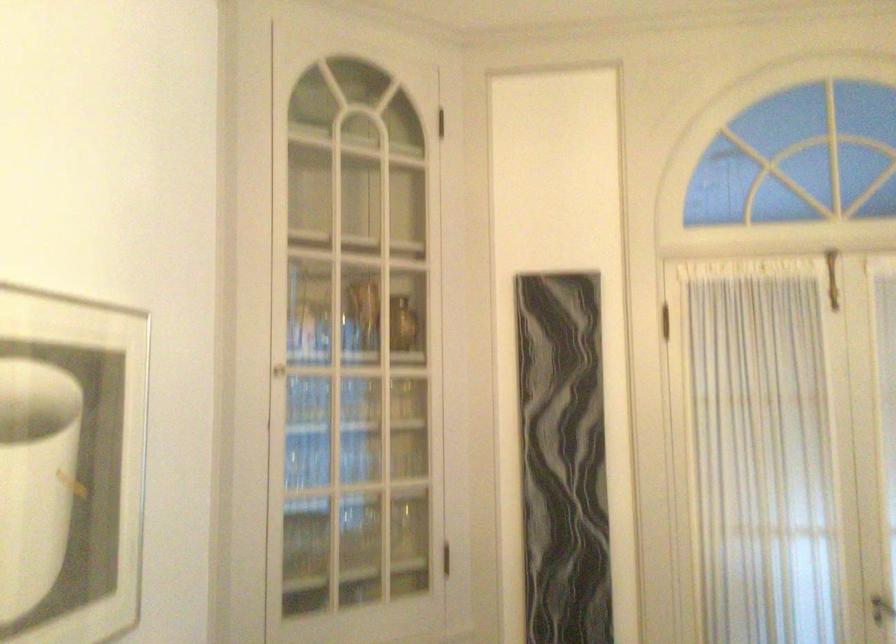
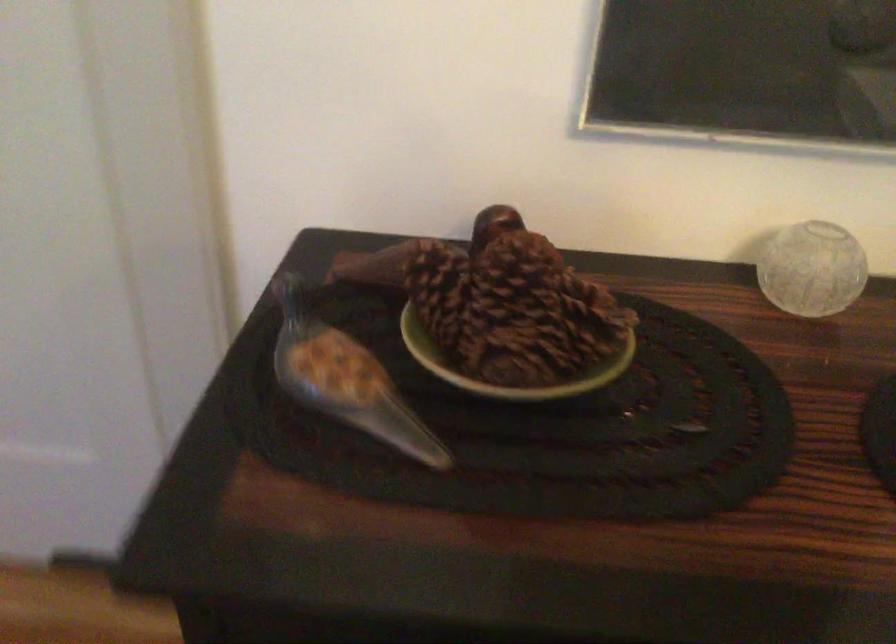
Based on the continuous images, in which direction is the camera rotating?

The camera's rotation is toward left-down.